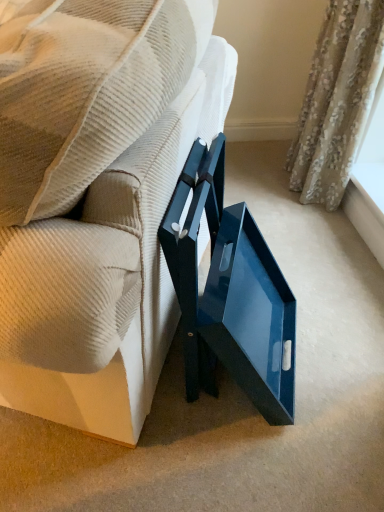
Question: Would you say floral fabric curtain at upper right is inside or outside white textured window sill at upper right?

Choices:
 (A) inside
 (B) outside

Answer: (B)

Question: Is floral fabric curtain at upper right taller or shorter than white textured window sill at upper right?

Choices:
 (A) short
 (B) tall

Answer: (B)

Question: Which is farther from the glossy blue tray at center?

Choices:
 (A) white textured window sill at upper right
 (B) floral fabric curtain at upper right

Answer: (A)

Question: Which object is positioned farthest from the floral fabric curtain at upper right?

Choices:
 (A) white textured window sill at upper right
 (B) glossy blue tray at center

Answer: (B)